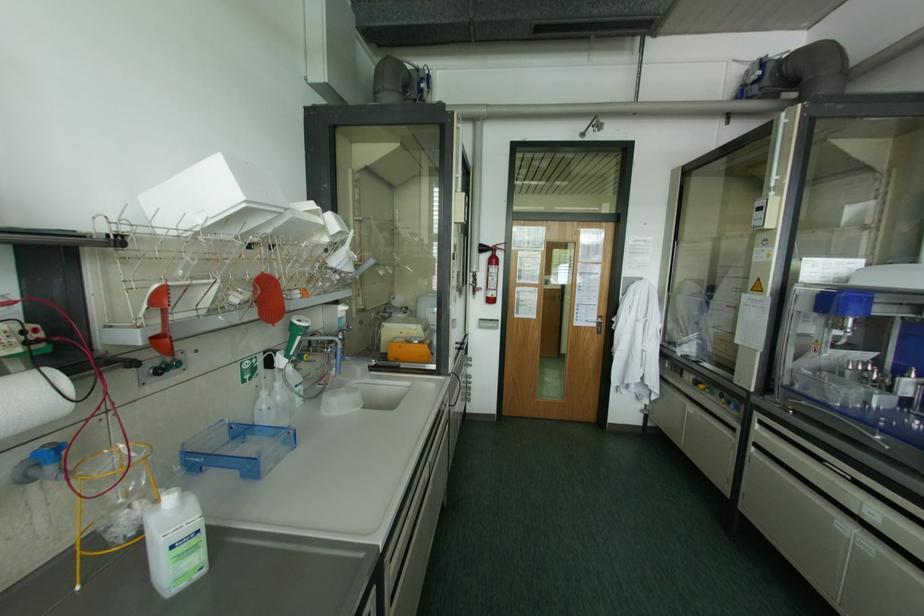
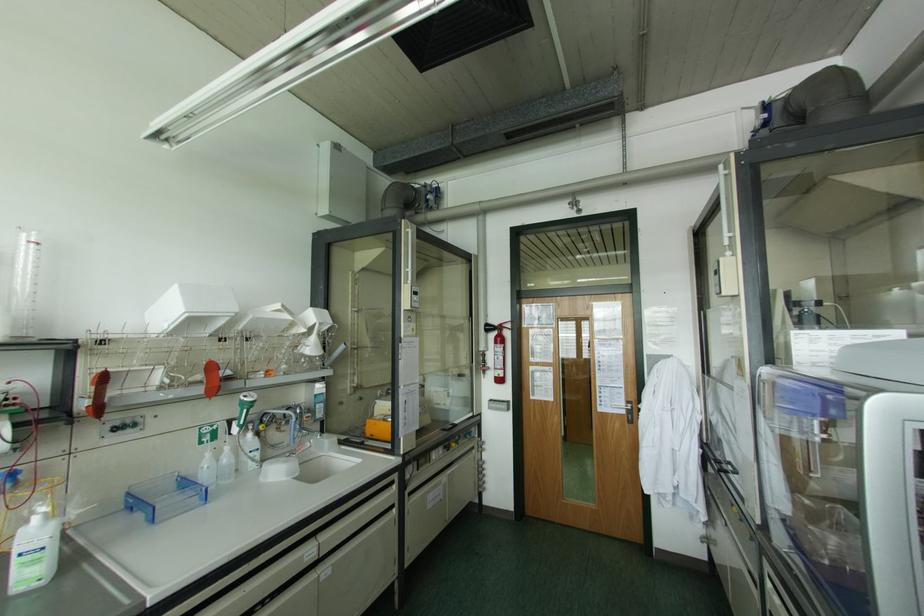
Where in the second image is the point corresponding to [502,246] from the first image?

(507, 325)